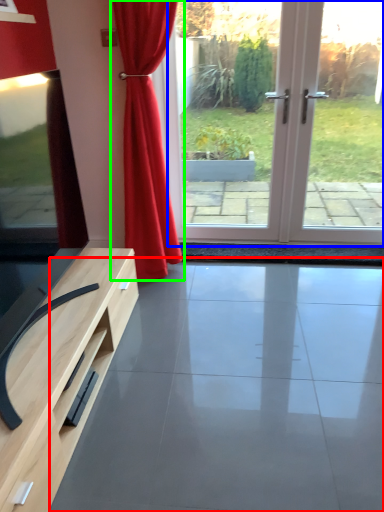
Question: Which object is the closest to the concrete (highlighted by a red box)? Choose among these: screen door (highlighted by a blue box) or curtain (highlighted by a green box).

Choices:
 (A) screen door
 (B) curtain

Answer: (B)